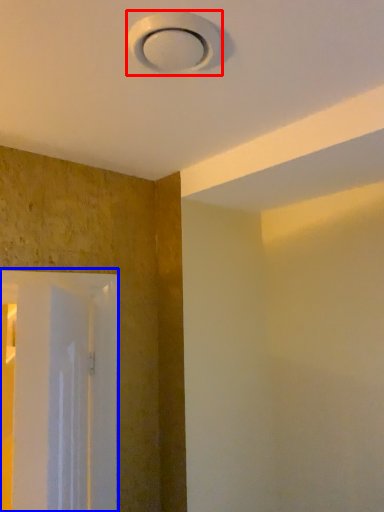
Question: Which object appears closest to the camera in this image, lamp (highlighted by a red box) or screen door (highlighted by a blue box)?

Choices:
 (A) lamp
 (B) screen door

Answer: (A)